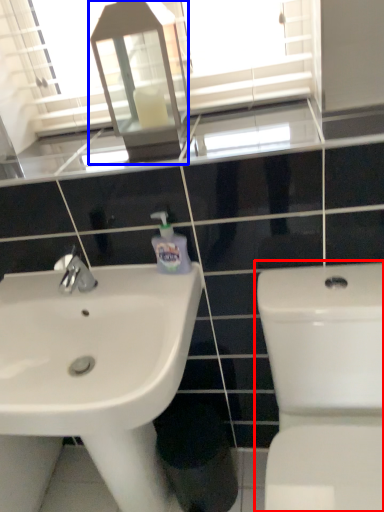
Question: Among these objects, which one is farthest to the camera, toilet (highlighted by a red box) or medicine cabinet (highlighted by a blue box)?

Choices:
 (A) toilet
 (B) medicine cabinet

Answer: (B)